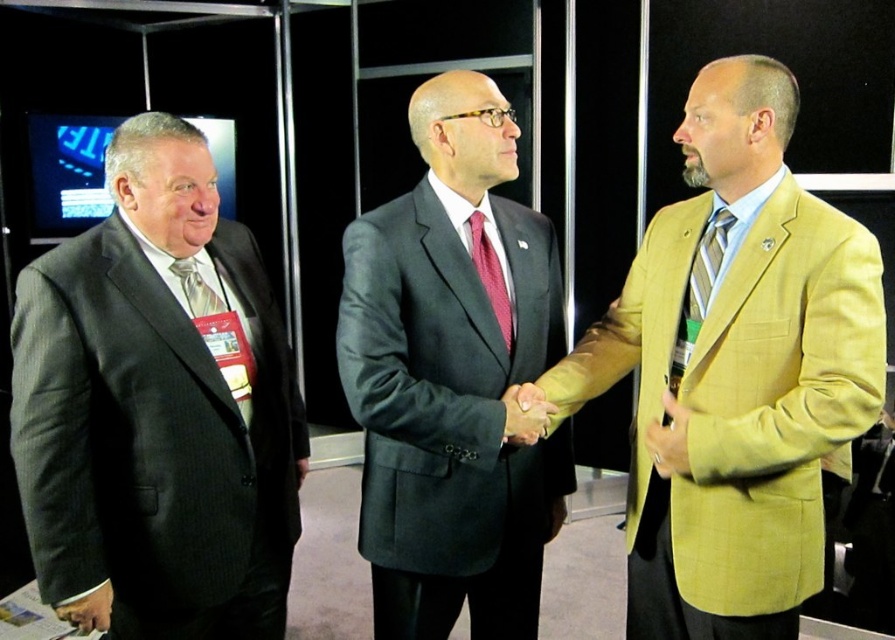
Question: Among these points, which one is farthest from the camera?

Choices:
 (A) (692, 316)
 (B) (499, 545)
 (C) (190, 268)
 (D) (169, 268)

Answer: (B)

Question: Is dark gray suit at center bigger than yellow fabric hand at center?

Choices:
 (A) no
 (B) yes

Answer: (B)

Question: Can you confirm if light olive-green suit at center is positioned to the right of striped silk tie at center?

Choices:
 (A) no
 (B) yes

Answer: (B)

Question: Which point is closer to the camera taking this photo?

Choices:
 (A) (505, 436)
 (B) (476, 234)
 (C) (214, 342)

Answer: (C)

Question: Which of the following is the farthest from the observer?

Choices:
 (A) maroon silk tie at center
 (B) smooth tan hand at center
 (C) yellow fabric hand at center

Answer: (A)

Question: Considering the relative positions of light olive-green suit at center and dark gray suit at center in the image provided, where is light olive-green suit at center located with respect to dark gray suit at center?

Choices:
 (A) below
 (B) above

Answer: (B)